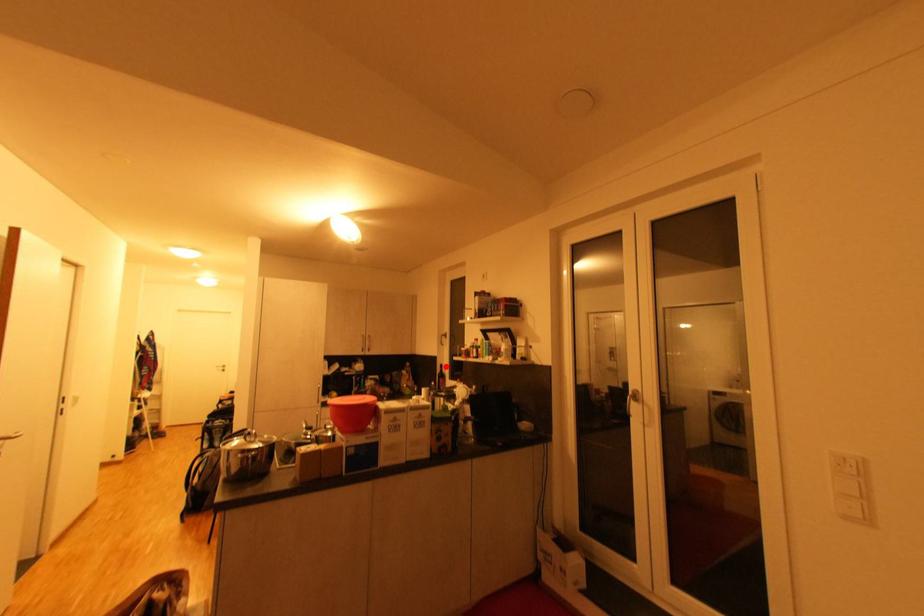
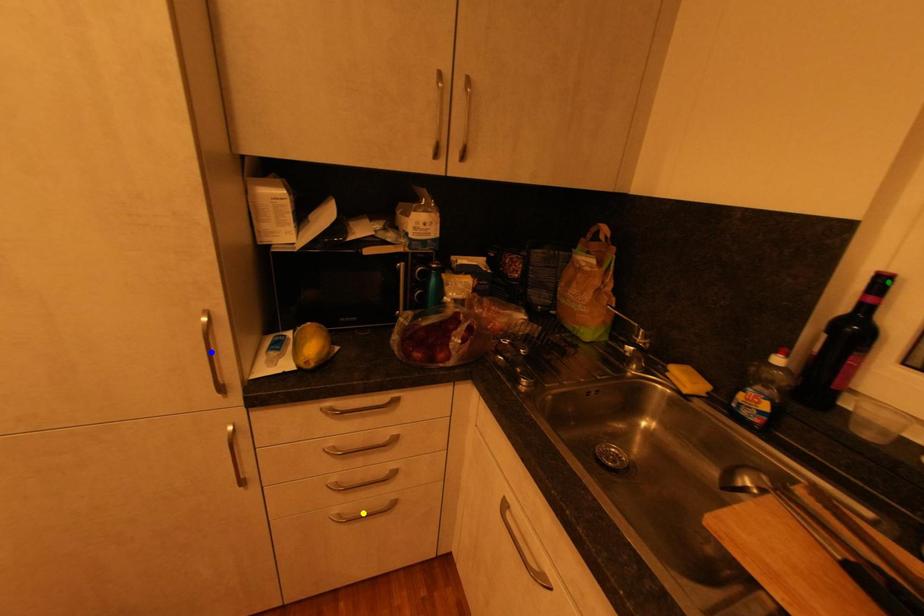
Question: I am providing you with two images of the same scene from different viewpoints. A red point is marked on the first image. You are given multiple points on the second image. Can you choose the point in image 2 that corresponds to the point in image 1?

Choices:
 (A) blue point
 (B) green point
 (C) yellow point

Answer: (B)